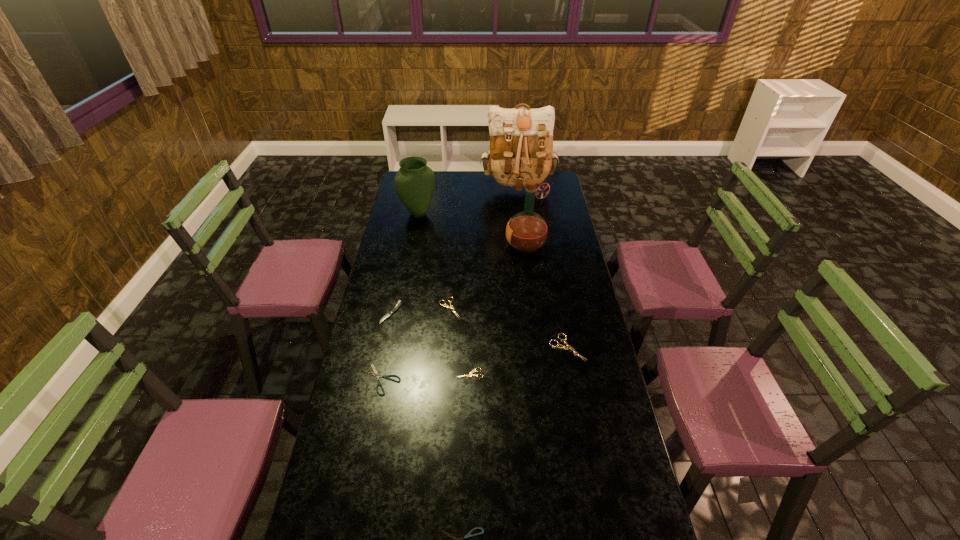
Where is `free space located on the front of the tallest shears`? This screenshot has height=540, width=960. free space located on the front of the tallest shears is located at coordinates (579, 412).

The image size is (960, 540). Find the location of `vacant region located 0.220m on the back of the sixth tallest object`. vacant region located 0.220m on the back of the sixth tallest object is located at coordinates (452, 263).

You are a GUI agent. You are given a task and a screenshot of the screen. Output one action in this format:
    pyautogui.click(x=<x>, y=<y>)
    Task: Click on the vacant space located on the back of the bigger black shears
    
    Given the screenshot: What is the action you would take?
    pyautogui.click(x=392, y=323)

This screenshot has height=540, width=960. Find the location of `free space located on the left of the nearest beige shears`. free space located on the left of the nearest beige shears is located at coordinates (366, 373).

Find the location of `object located at the far edge`. object located at the far edge is located at coordinates (521, 139).

This screenshot has height=540, width=960. I want to click on vase that is positioned at the left edge, so click(x=414, y=182).

I want to click on pocketknife positioned at the left edge, so click(x=398, y=305).

Find the location of `shears located at the left edge`. shears located at the left edge is located at coordinates (375, 373).

Find the location of a particular element. backpack situated at the right edge is located at coordinates (521, 139).

The height and width of the screenshot is (540, 960). I want to click on liquor located in the right edge section of the desktop, so click(526, 232).